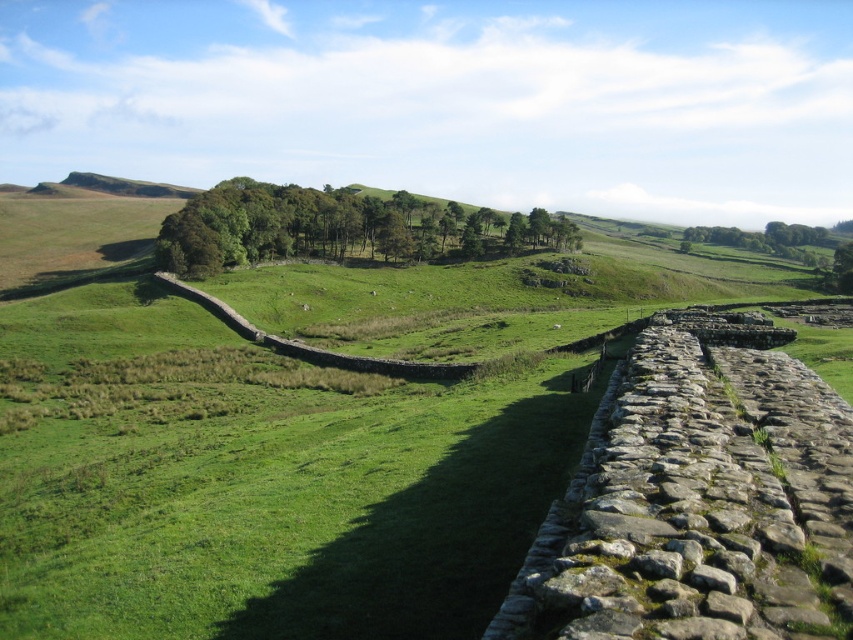
Can you confirm if green grass at center is positioned below green leafy trees at center?

Indeed, green grass at center is positioned under green leafy trees at center.

Who is more forward, (408, 509) or (347, 188)?

Point (408, 509) is more forward.

Is point (190, 564) positioned behind point (432, 240)?

No, it is not.

Locate an element on the screen. This screenshot has height=640, width=853. green grass at center is located at coordinates (241, 460).